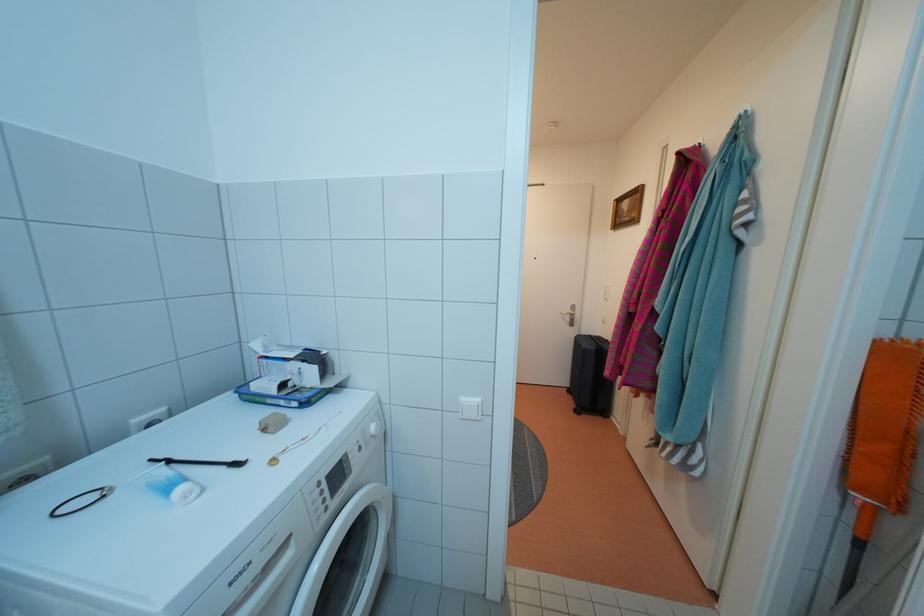
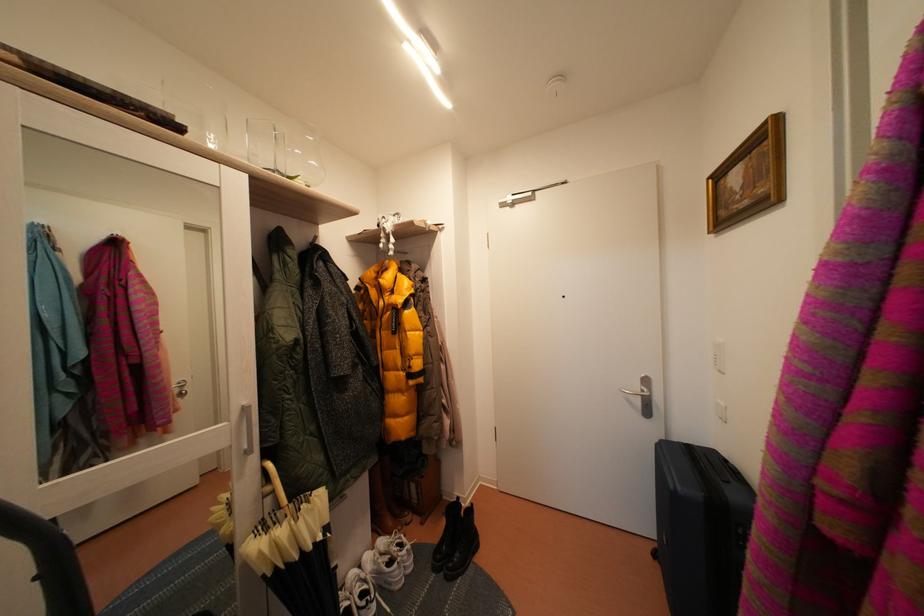
Consider the image. Which direction would the cameraman need to move to produce the second image?

The cameraman moved toward right, forward.